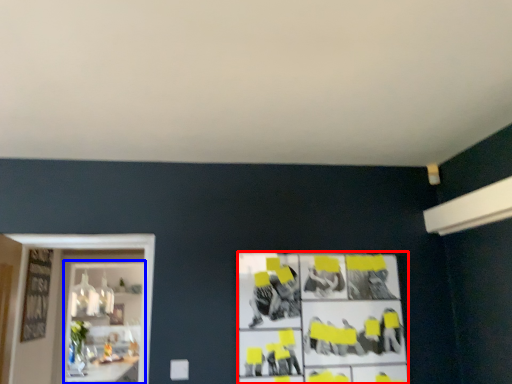
Question: Which object is further to the camera taking this photo, poster (highlighted by a red box) or shelf (highlighted by a blue box)?

Choices:
 (A) poster
 (B) shelf

Answer: (B)